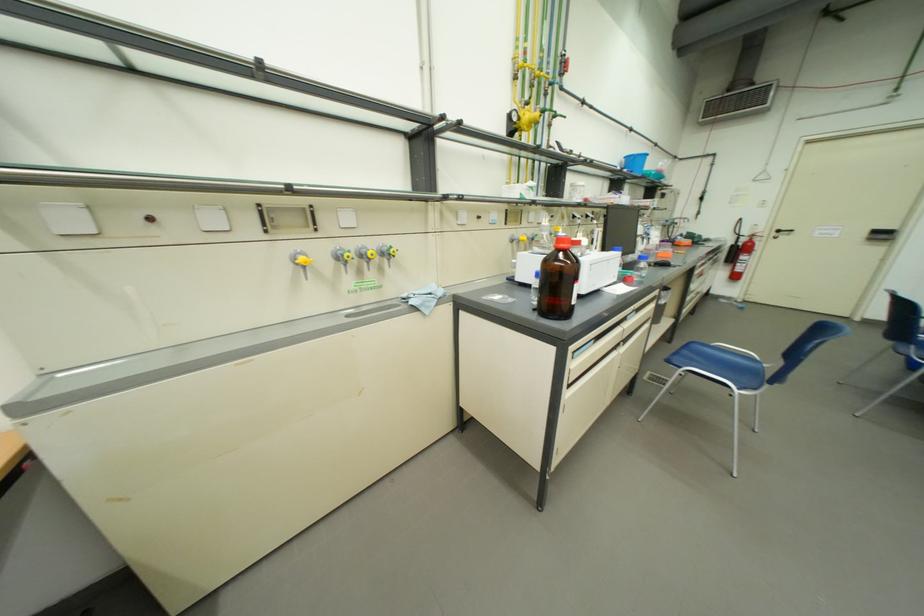
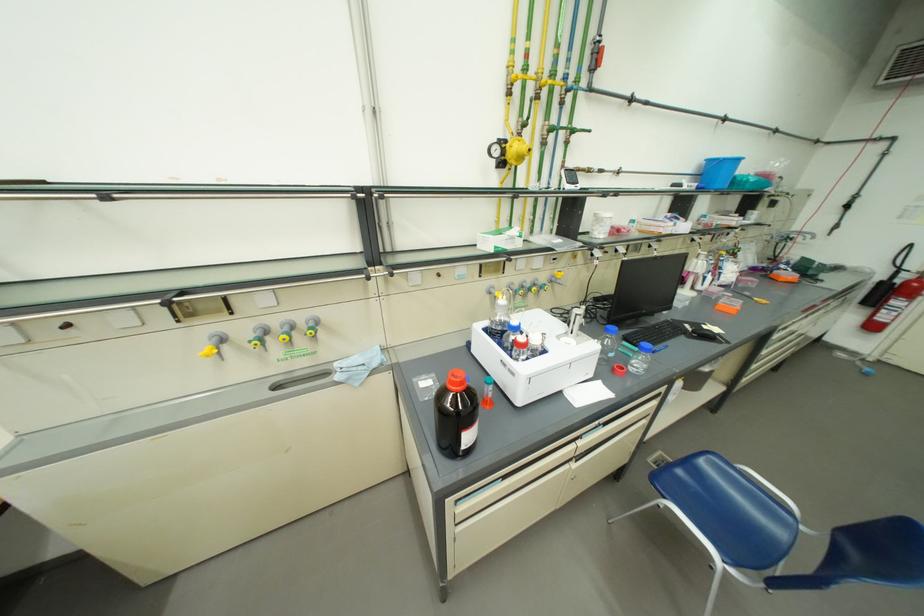
The images are taken continuously from a first-person perspective. In which direction are you moving?

The cameraman moved toward right, forward.